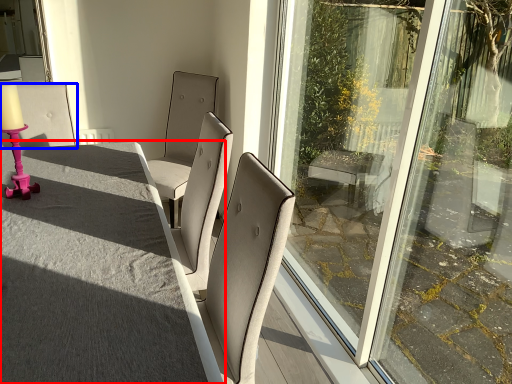
Question: Which point is further to the camera, table (highlighted by a red box) or chair (highlighted by a blue box)?

Choices:
 (A) table
 (B) chair

Answer: (B)